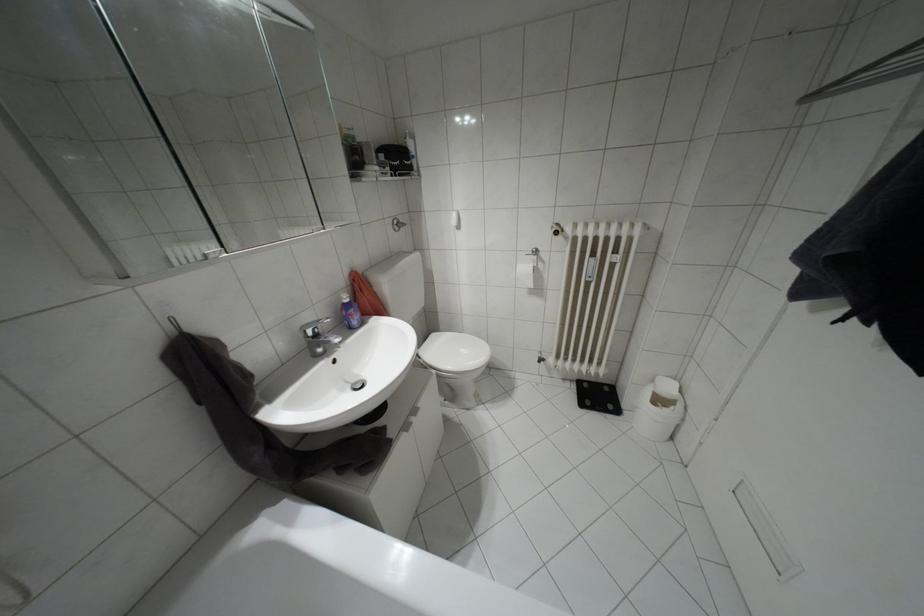
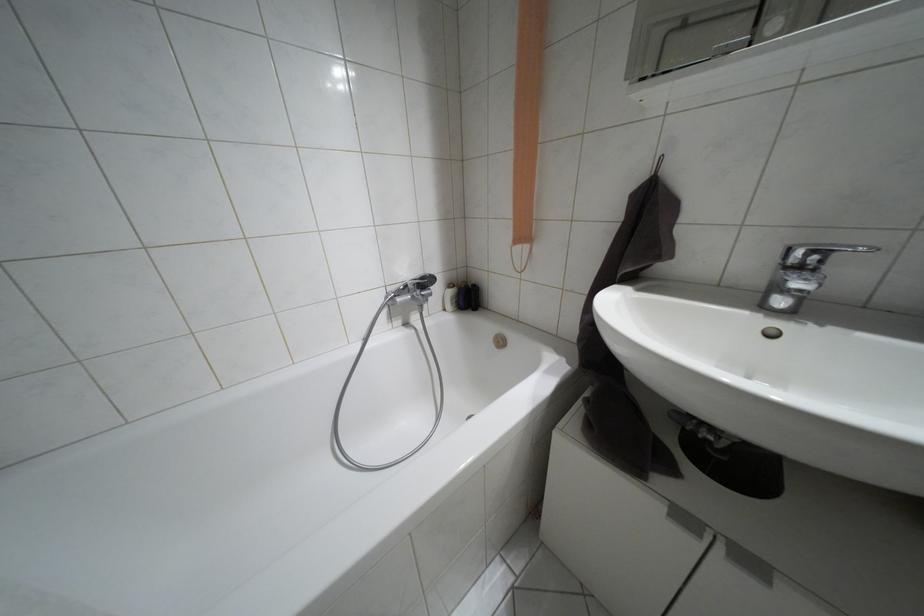
Locate, in the second image, the point that corresponds to [406,427] in the first image.

(684, 517)